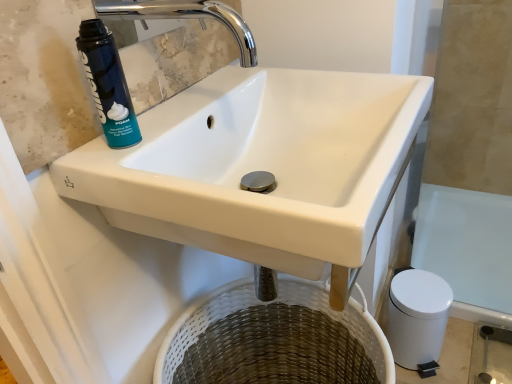
Question: Based on their positions, is blue matte shaving cream can at upper left located to the left or right of white ceramic sink at upper center?

Choices:
 (A) left
 (B) right

Answer: (A)

Question: Choose the correct answer: Is blue matte shaving cream can at upper left inside white ceramic sink at upper center or outside it?

Choices:
 (A) outside
 (B) inside

Answer: (A)

Question: Estimate the real-world distances between objects in this image. Which object is closer to the blue matte shaving cream can at upper left?

Choices:
 (A) chrome metallic faucet at upper center
 (B) woven white basket at lower center
 (C) white ceramic sink at upper center

Answer: (A)

Question: Considering the real-world distances, which object is farthest from the blue matte shaving cream can at upper left?

Choices:
 (A) woven white basket at lower center
 (B) chrome metallic faucet at upper center
 (C) white ceramic sink at upper center

Answer: (A)